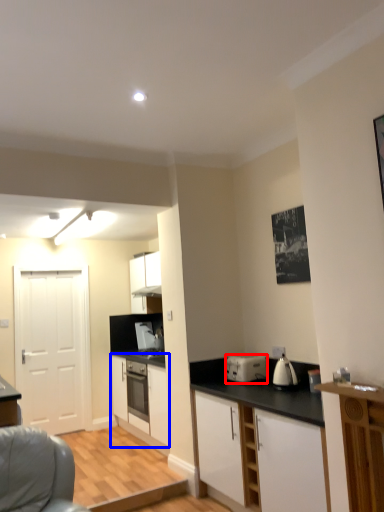
Question: Which of the following is the closest to the observer, kitchen appliance (highlighted by a red box) or cabinetry (highlighted by a blue box)?

Choices:
 (A) kitchen appliance
 (B) cabinetry

Answer: (A)